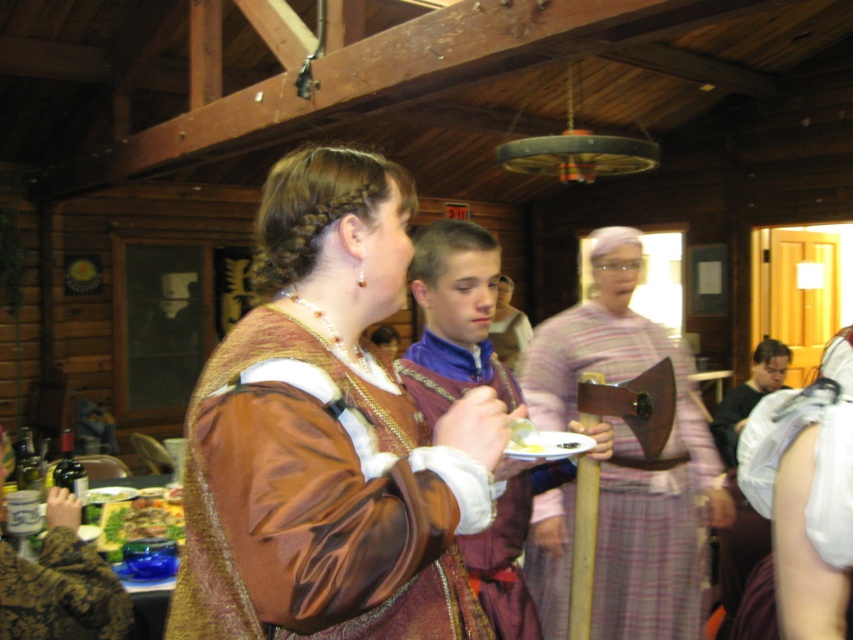
Question: Estimate the real-world distances between objects in this image. Which object is farther from the purple satin shirt at center?

Choices:
 (A) yellow creamy food at center
 (B) satin brown dress at center
 (C) green leafy salad at lower left
 (D) white satin dress at lower right

Answer: (B)

Question: Is green leafy salad at lower left thinner than purple satin shirt at center?

Choices:
 (A) no
 (B) yes

Answer: (A)

Question: Does plaid fabric axe at center have a smaller size compared to dark green fabric shirt at right?

Choices:
 (A) yes
 (B) no

Answer: (B)

Question: Can you confirm if plaid fabric axe at center is positioned above white satin dress at lower right?

Choices:
 (A) no
 (B) yes

Answer: (B)

Question: Among these points, which one is nearest to the camera?

Choices:
 (A) (850, 579)
 (B) (311, 364)
 (C) (786, 353)
 (D) (509, 305)

Answer: (B)

Question: Which object is positioned closest to the white satin dress at lower right?

Choices:
 (A) satin brown dress at center
 (B) dark green fabric shirt at right
 (C) yellow creamy food at center

Answer: (C)